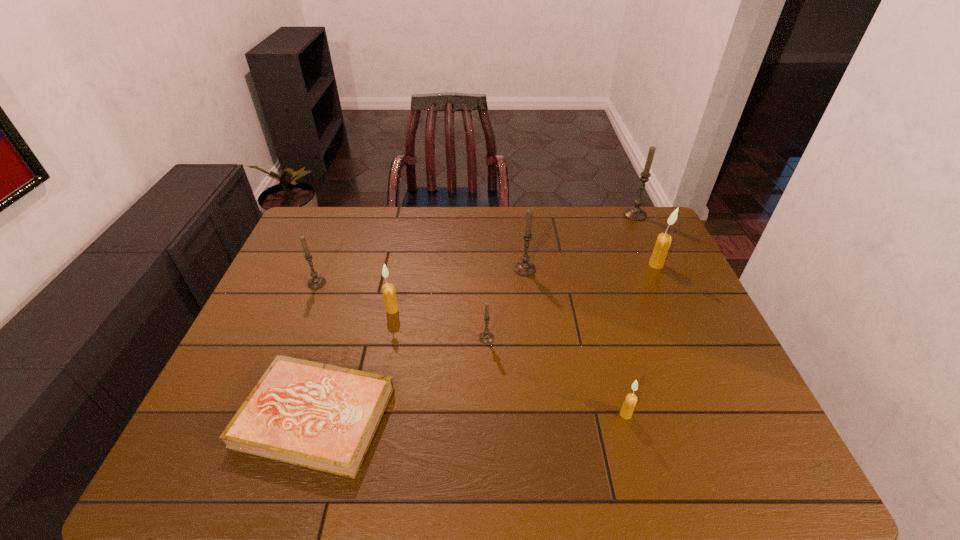
At what (x,y) coordinates should I click in order to perform the action: click on the smallest gray candle. Please return your answer as a coordinate pair (x, y). The image size is (960, 540). Looking at the image, I should click on [x=486, y=337].

Find the location of `the fifth candle from right to left`. the fifth candle from right to left is located at coordinates (486, 337).

Locate an element on the screen. the sixth object from left to right is located at coordinates (629, 404).

The height and width of the screenshot is (540, 960). Identify the location of the nearest cream candle. pyautogui.click(x=629, y=404).

I want to click on the shortest object, so click(x=319, y=416).

Image resolution: width=960 pixels, height=540 pixels. Find the location of `free space located on the left of the tallest object`. free space located on the left of the tallest object is located at coordinates (602, 214).

Where is `vacant space located on the right of the third gray candle from left to right`? vacant space located on the right of the third gray candle from left to right is located at coordinates (583, 269).

This screenshot has width=960, height=540. In order to click on vacant space located 0.220m on the front of the farthest cream candle in this screenshot , I will do `click(682, 321)`.

At what (x,y) coordinates should I click in order to perform the action: click on free space located 0.150m on the front of the second smallest cream candle. Please return your answer as a coordinate pair (x, y). This screenshot has width=960, height=540. Looking at the image, I should click on (383, 356).

Image resolution: width=960 pixels, height=540 pixels. In order to click on vacant area located on the right of the leftmost gray candle in this screenshot , I will do `click(457, 283)`.